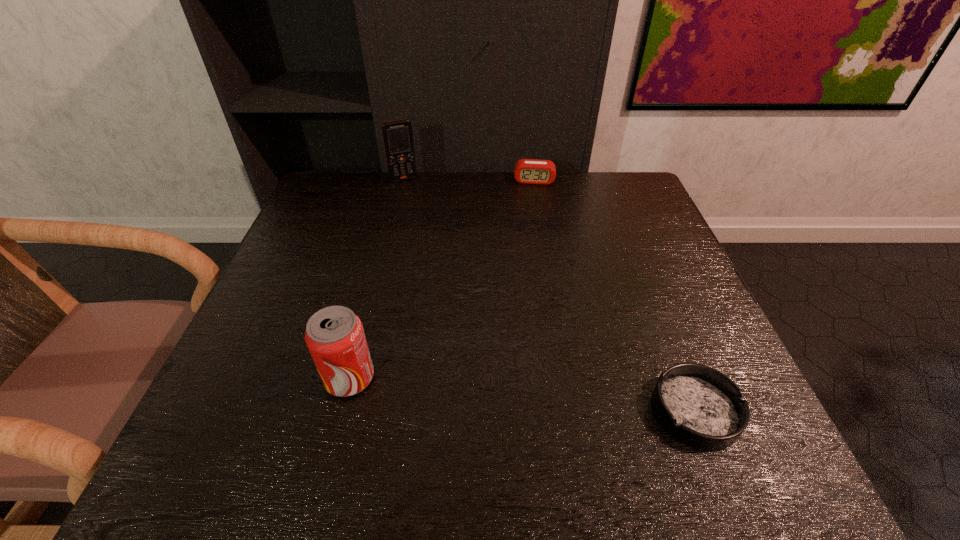
Identify the location of vacant region located on the front-facing side of the second shortest object. This screenshot has height=540, width=960. (531, 273).

Where is `free space located 0.050m on the screen of the cellular telephone`? free space located 0.050m on the screen of the cellular telephone is located at coordinates (412, 192).

Image resolution: width=960 pixels, height=540 pixels. What are the coordinates of `vacant area situated 0.200m on the screen of the cellular telephone` in the screenshot? It's located at (426, 220).

Find the location of a particular element. This screenshot has height=540, width=960. vacant area located on the screen of the cellular telephone is located at coordinates (420, 208).

The width and height of the screenshot is (960, 540). I want to click on alarm clock present at the far edge, so click(528, 171).

Where is `cellular telephone located in the far edge section of the desktop`? Image resolution: width=960 pixels, height=540 pixels. cellular telephone located in the far edge section of the desktop is located at coordinates (398, 139).

Locate an element on the screen. The width and height of the screenshot is (960, 540). soda can at the near edge is located at coordinates (334, 335).

I want to click on ashtray present at the near edge, so click(699, 406).

Image resolution: width=960 pixels, height=540 pixels. In order to click on object located at the right edge in this screenshot , I will do `click(699, 406)`.

Where is `object that is at the near right corner`? The width and height of the screenshot is (960, 540). object that is at the near right corner is located at coordinates (699, 406).